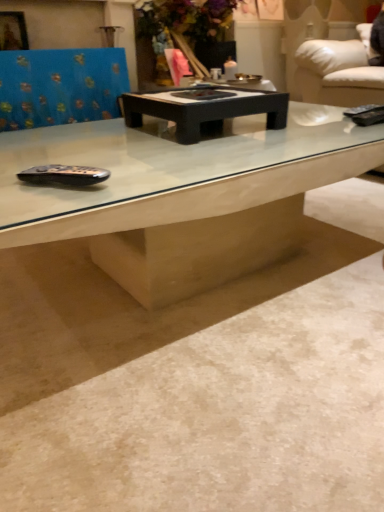
Question: Is black matte coffee table at center to the right of blue fabric swivel chair at upper left from the viewer's perspective?

Choices:
 (A) yes
 (B) no

Answer: (A)

Question: Considering the relative positions of black matte coffee table at center and blue fabric swivel chair at upper left in the image provided, is black matte coffee table at center in front of blue fabric swivel chair at upper left?

Choices:
 (A) yes
 (B) no

Answer: (A)

Question: Are black matte coffee table at center and blue fabric swivel chair at upper left making contact?

Choices:
 (A) no
 (B) yes

Answer: (A)

Question: Considering the relative sizes of black matte coffee table at center and blue fabric swivel chair at upper left in the image provided, is black matte coffee table at center bigger than blue fabric swivel chair at upper left?

Choices:
 (A) no
 (B) yes

Answer: (A)

Question: Could blue fabric swivel chair at upper left be considered to be inside black matte coffee table at center?

Choices:
 (A) yes
 (B) no

Answer: (B)

Question: Choose the correct answer: Is white marble concrete at center inside black matte coffee table at center or outside it?

Choices:
 (A) outside
 (B) inside

Answer: (A)

Question: Is white marble concrete at center to the left or to the right of black matte coffee table at center in the image?

Choices:
 (A) right
 (B) left

Answer: (A)

Question: Relative to black matte coffee table at center, is white marble concrete at center in front or behind?

Choices:
 (A) behind
 (B) front

Answer: (B)

Question: From the image's perspective, is white marble concrete at center above or below black matte coffee table at center?

Choices:
 (A) below
 (B) above

Answer: (A)

Question: Would you say blue fabric swivel chair at upper left is inside or outside white marble concrete at center?

Choices:
 (A) outside
 (B) inside

Answer: (A)

Question: Is blue fabric swivel chair at upper left in front of or behind white marble concrete at center in the image?

Choices:
 (A) front
 (B) behind

Answer: (B)

Question: From a real-world perspective, is blue fabric swivel chair at upper left physically located above or below white marble concrete at center?

Choices:
 (A) above
 (B) below

Answer: (A)

Question: Based on their positions, is blue fabric swivel chair at upper left located to the left or right of white marble concrete at center?

Choices:
 (A) left
 (B) right

Answer: (A)

Question: From the image's perspective, is black matte coffee table at center above or below white marble concrete at center?

Choices:
 (A) below
 (B) above

Answer: (B)

Question: Relative to white marble concrete at center, is black matte coffee table at center in front or behind?

Choices:
 (A) behind
 (B) front

Answer: (A)